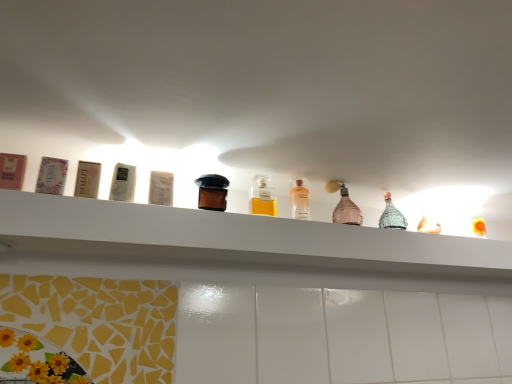
Question: In the image, is brown glass bottle at center, placed as the first bottle when sorted from left to right, on the left side or the right side of yellow glass bottle at center, which is the 3th bottle from right to left?

Choices:
 (A) left
 (B) right

Answer: (A)

Question: From the image's perspective, is brown glass bottle at center, placed as the first bottle when sorted from left to right, positioned above or below yellow glass bottle at center, which is the 3th bottle from right to left?

Choices:
 (A) below
 (B) above

Answer: (B)

Question: Considering the real-world distances, which object is farthest from the yellow glass bottle at center, which is the 3th bottle from right to left?

Choices:
 (A) clear glass bottle at center, positioned as the 3th bottle in left-to-right order
 (B) white glossy shelf at upper center
 (C) brown glass bottle at center, the 4th bottle viewed from the right
 (D) pink matte bottle at center, placed as the fourth bottle when sorted from left to right

Answer: (B)

Question: Considering the real-world distances, which object is closest to the yellow glass bottle at center, placed as the second bottle when sorted from left to right?

Choices:
 (A) brown glass bottle at center, placed as the first bottle when sorted from left to right
 (B) white glossy shelf at upper center
 (C) pink matte bottle at center, placed as the fourth bottle when sorted from left to right
 (D) clear glass bottle at center, placed as the second bottle when sorted from right to left

Answer: (D)